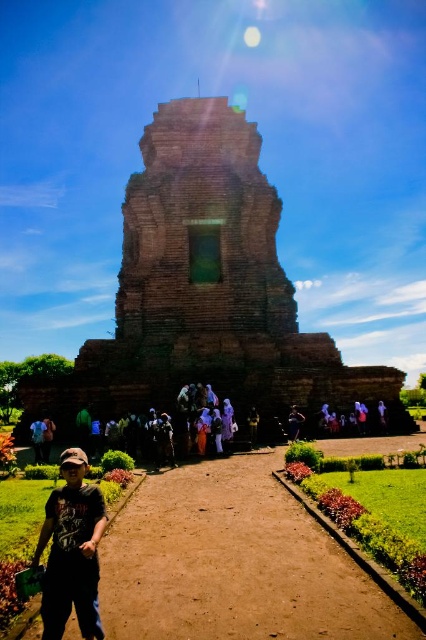
Question: Among these objects, which one is nearest to the camera?

Choices:
 (A) brown brick temple at center
 (B) dark blue fabric at center
 (C) brown dirt path at center
 (D) blue denim jeans at lower left

Answer: (C)

Question: Is brown brick temple at center smaller than dark blue fabric at center?

Choices:
 (A) no
 (B) yes

Answer: (A)

Question: Considering the real-world distances, which object is farthest from the blue denim jeans at lower left?

Choices:
 (A) brown dirt path at center
 (B) dark gray fabric cap at lower left
 (C) brown fabric tourist at center
 (D) brown brick temple at center

Answer: (D)

Question: Does brown brick temple at center appear over brown fabric tourist at center?

Choices:
 (A) yes
 (B) no

Answer: (A)

Question: Among these objects, which one is farthest from the camera?

Choices:
 (A) brown brick temple at center
 (B) dark blue fabric at center
 (C) dark gray fabric cap at lower left

Answer: (A)

Question: Is brown dirt path at center closer to the viewer compared to dark gray fabric cap at lower left?

Choices:
 (A) no
 (B) yes

Answer: (B)